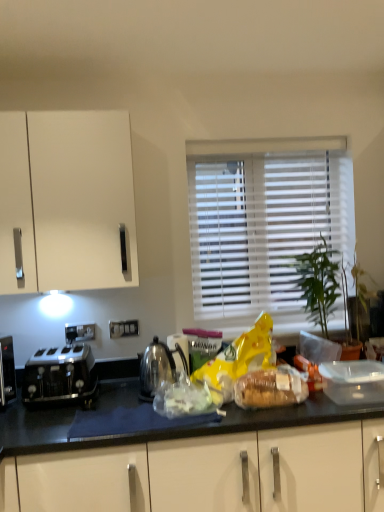
Find the location of a particular element. The image size is (384, 512). empty space that is ontop of satin black toaster at left (from a real-world perspective) is located at coordinates (65, 355).